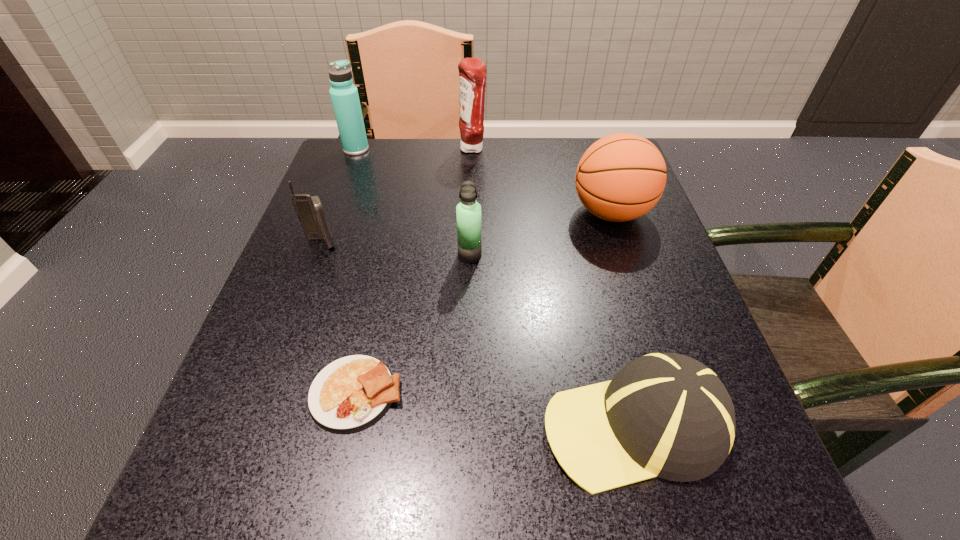
The image size is (960, 540). What are the coordinates of `thermos bottle positioned at the far edge` in the screenshot? It's located at (x=344, y=95).

Find the location of a particular element. This screenshot has width=960, height=540. basketball located in the far edge section of the desktop is located at coordinates (620, 177).

Where is `object at the near edge`? object at the near edge is located at coordinates (667, 415).

The image size is (960, 540). Find the location of `thermos bottle at the left edge`. thermos bottle at the left edge is located at coordinates (344, 95).

Locate an element on the screen. cellular telephone positioned at the left edge is located at coordinates (309, 209).

This screenshot has width=960, height=540. I want to click on omelet that is at the left edge, so click(x=351, y=393).

Identify the location of basketball positioned at the right edge. This screenshot has width=960, height=540. (620, 177).

Locate an element on the screen. The width and height of the screenshot is (960, 540). baseball cap that is at the right edge is located at coordinates (667, 415).

Identify the location of object present at the far left corner. Image resolution: width=960 pixels, height=540 pixels. (344, 95).

Image resolution: width=960 pixels, height=540 pixels. I want to click on object situated at the far right corner, so click(x=620, y=177).